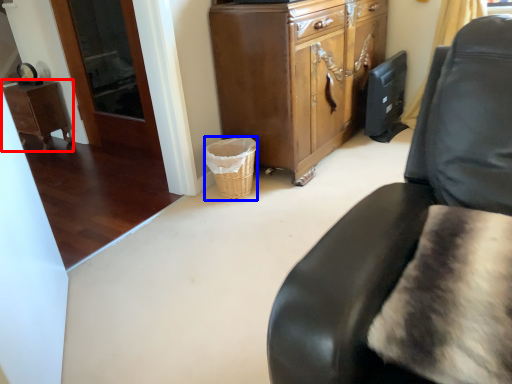
Question: Which object appears farthest to the camera in this image, desk (highlighted by a red box) or basket (highlighted by a blue box)?

Choices:
 (A) desk
 (B) basket

Answer: (A)